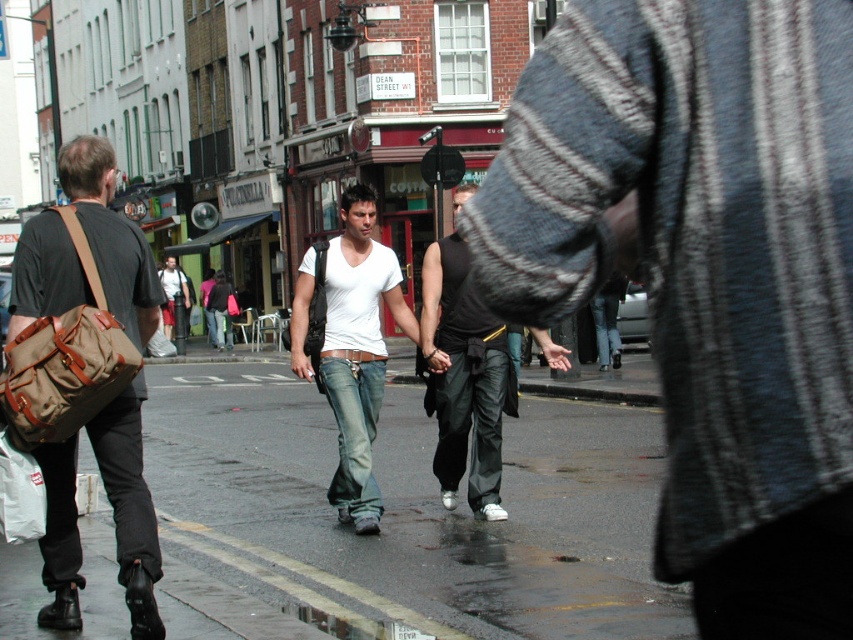
Question: Does wet asphalt at lower center have a greater width compared to white matte shirt at center?

Choices:
 (A) yes
 (B) no

Answer: (A)

Question: Which of the following is the farthest from the observer?

Choices:
 (A) black leather pants at center
 (B) wet asphalt at lower center
 (C) matte brown bag at left
 (D) white matte t-shirt at center

Answer: (A)

Question: Does matte brown bag at left appear on the right side of white matte shirt at center?

Choices:
 (A) no
 (B) yes

Answer: (A)

Question: Is white matte shirt at center bigger than light brown leather jacket at center?

Choices:
 (A) no
 (B) yes

Answer: (A)

Question: Which object is farther from the camera taking this photo?

Choices:
 (A) light brown leather jacket at center
 (B) white matte t-shirt at center
 (C) black leather pants at center

Answer: (C)

Question: Estimate the real-world distances between objects in this image. Which object is farther from the white matte t-shirt at center?

Choices:
 (A) light brown leather jacket at center
 (B) white matte shirt at center
 (C) black leather pants at center

Answer: (A)